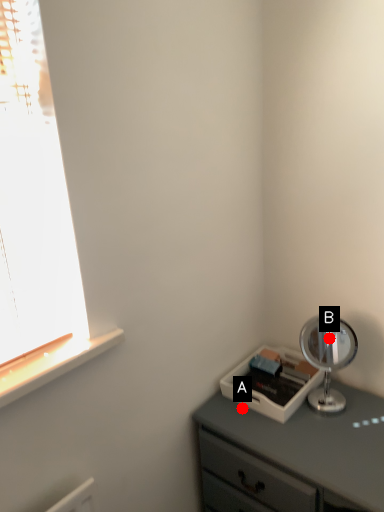
Question: Two points are circled on the image, labeled by A and B beside each circle. Which point appears farthest from the camera in this image?

Choices:
 (A) A is further
 (B) B is further

Answer: (B)